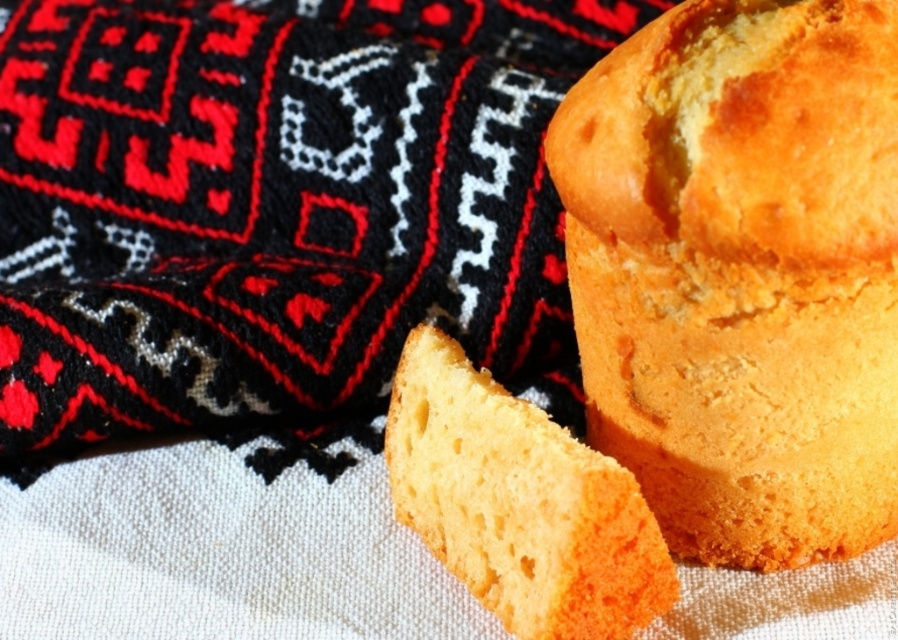
Can you confirm if golden sponge muffin at center is positioned to the left of yellow sponge cake at center?

No, golden sponge muffin at center is not to the left of yellow sponge cake at center.

Is point (714, 77) positioned in front of point (531, 422)?

Yes, point (714, 77) is closer to viewer.

Who is more distant from viewer, [750,529] or [386,424]?

Point [386,424]

The height and width of the screenshot is (640, 898). I want to click on golden sponge muffin at center, so click(x=741, y=273).